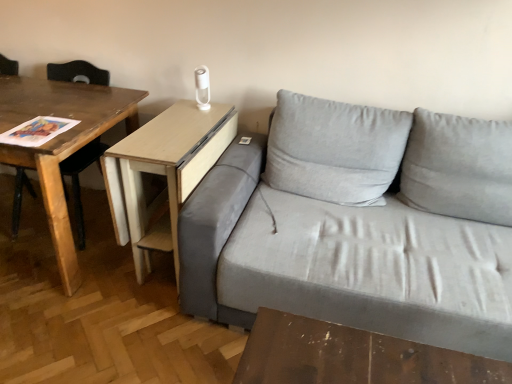
Question: Is wooden table at left, which is the 1th table in left-to-right order, located outside light wood/woodenobject at center, which ranks as the first table in right-to-left order?

Choices:
 (A) no
 (B) yes

Answer: (B)

Question: Is wooden table at left, which is the 1th table in left-to-right order, to the left of light wood/woodenobject at center, which appears as the second table when viewed from the left, from the viewer's perspective?

Choices:
 (A) no
 (B) yes

Answer: (B)

Question: Is wooden table at left, arranged as the 2th table when viewed from the right, thinner than light wood/woodenobject at center, which appears as the second table when viewed from the left?

Choices:
 (A) yes
 (B) no

Answer: (B)

Question: Is wooden table at left, which is the 1th table in left-to-right order, to the right of light wood/woodenobject at center, which appears as the second table when viewed from the left, from the viewer's perspective?

Choices:
 (A) no
 (B) yes

Answer: (A)

Question: Is wooden table at left, which is the 1th table in left-to-right order, aimed at light wood/woodenobject at center, which ranks as the first table in right-to-left order?

Choices:
 (A) yes
 (B) no

Answer: (B)

Question: Does wooden table at left, arranged as the 2th table when viewed from the right, come in front of light wood/woodenobject at center, which ranks as the first table in right-to-left order?

Choices:
 (A) yes
 (B) no

Answer: (A)

Question: Considering the relative positions of light wood/woodenobject at center, which appears as the second table when viewed from the left, and wooden table at left, arranged as the 2th table when viewed from the right, in the image provided, is light wood/woodenobject at center, which appears as the second table when viewed from the left, to the right of wooden table at left, arranged as the 2th table when viewed from the right, from the viewer's perspective?

Choices:
 (A) yes
 (B) no

Answer: (A)

Question: Can you confirm if light wood/woodenobject at center, which appears as the second table when viewed from the left, is shorter than wooden table at left, arranged as the 2th table when viewed from the right?

Choices:
 (A) no
 (B) yes

Answer: (B)

Question: Is wooden table at left, which is the 1th table in left-to-right order, at the back of light wood/woodenobject at center, which ranks as the first table in right-to-left order?

Choices:
 (A) yes
 (B) no

Answer: (B)

Question: Can you confirm if light wood/woodenobject at center, which appears as the second table when viewed from the left, is positioned to the left of wooden table at left, arranged as the 2th table when viewed from the right?

Choices:
 (A) yes
 (B) no

Answer: (B)

Question: From a real-world perspective, is light wood/woodenobject at center, which appears as the second table when viewed from the left, on wooden table at left, arranged as the 2th table when viewed from the right?

Choices:
 (A) yes
 (B) no

Answer: (B)

Question: Does light wood/woodenobject at center, which ranks as the first table in right-to-left order, have a larger size compared to wooden table at left, which is the 1th table in left-to-right order?

Choices:
 (A) yes
 (B) no

Answer: (B)

Question: Does wooden table at left, which is the 1th table in left-to-right order, have a greater height compared to gray fabric couch at center?

Choices:
 (A) yes
 (B) no

Answer: (B)